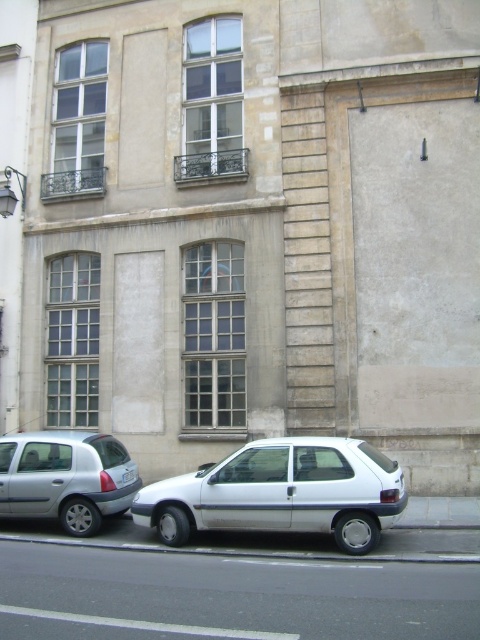
Is the position of silver metallic minivan at lower left more distant than that of gray concrete curb at lower center?

Yes, silver metallic minivan at lower left is behind gray concrete curb at lower center.

Does silver metallic minivan at lower left have a lesser height compared to gray concrete curb at lower center?

In fact, silver metallic minivan at lower left may be taller than gray concrete curb at lower center.

Does point (75, 522) come farther from viewer compared to point (121, 547)?

Yes, it is.

The image size is (480, 640). I want to click on silver metallic minivan at lower left, so click(64, 477).

Does silver metallic minivan at lower left come in front of white plastic license plate at lower center?

That is True.

Is point (66, 500) farther from camera compared to point (135, 476)?

That is False.

Where is `silver metallic minivan at lower left`? The height and width of the screenshot is (640, 480). silver metallic minivan at lower left is located at coordinates (64, 477).

Between gray concrete curb at lower center and white plastic license plate at lower center, which one is positioned lower?

gray concrete curb at lower center

The height and width of the screenshot is (640, 480). I want to click on gray concrete curb at lower center, so click(x=247, y=550).

Does point (192, 552) lie in front of point (130, 474)?

Yes, point (192, 552) is in front of point (130, 474).

Locate an element on the screen. The width and height of the screenshot is (480, 640). gray concrete curb at lower center is located at coordinates (247, 550).